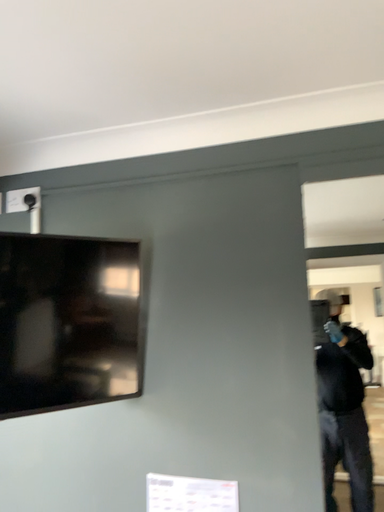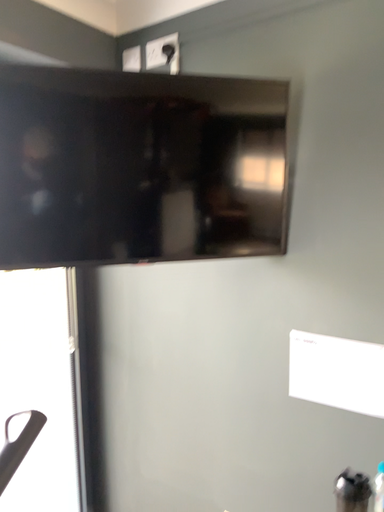
Question: Which way did the camera rotate in the video?

Choices:
 (A) rotated right
 (B) rotated left

Answer: (B)